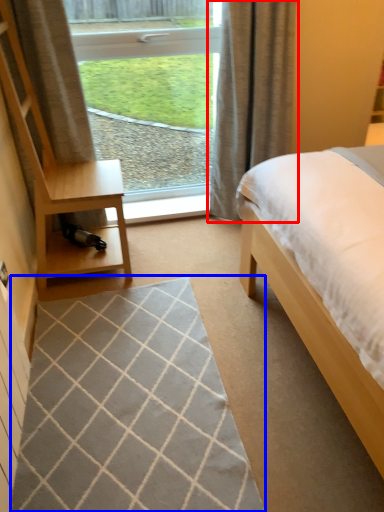
Question: Which of the following is the closest to the observer, curtain (highlighted by a red box) or mat (highlighted by a blue box)?

Choices:
 (A) curtain
 (B) mat

Answer: (B)